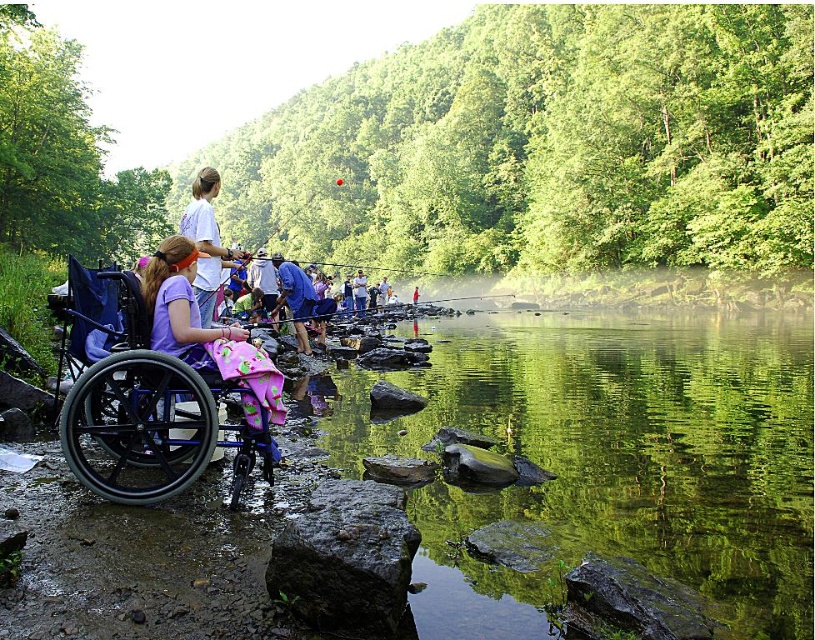
Question: Which point is farther from the camera taking this photo?

Choices:
 (A) (184, 280)
 (B) (168, 369)
 (C) (210, 275)

Answer: (C)

Question: Considering the real-world distances, which object is farthest from the blue fabric at center?

Choices:
 (A) green smooth water at center
 (B) white cotton shirt at upper center

Answer: (A)

Question: Does matte purple shirt at center have a lesser width compared to white cotton shirt at upper center?

Choices:
 (A) yes
 (B) no

Answer: (A)

Question: Can you confirm if matte purple shirt at center is smaller than blue fabric at center?

Choices:
 (A) no
 (B) yes

Answer: (B)

Question: Is blue plastic wheelchair at left smaller than blue fabric at center?

Choices:
 (A) yes
 (B) no

Answer: (A)

Question: Which point is farther to the camera?

Choices:
 (A) white cotton shirt at upper center
 (B) green smooth water at center

Answer: (A)